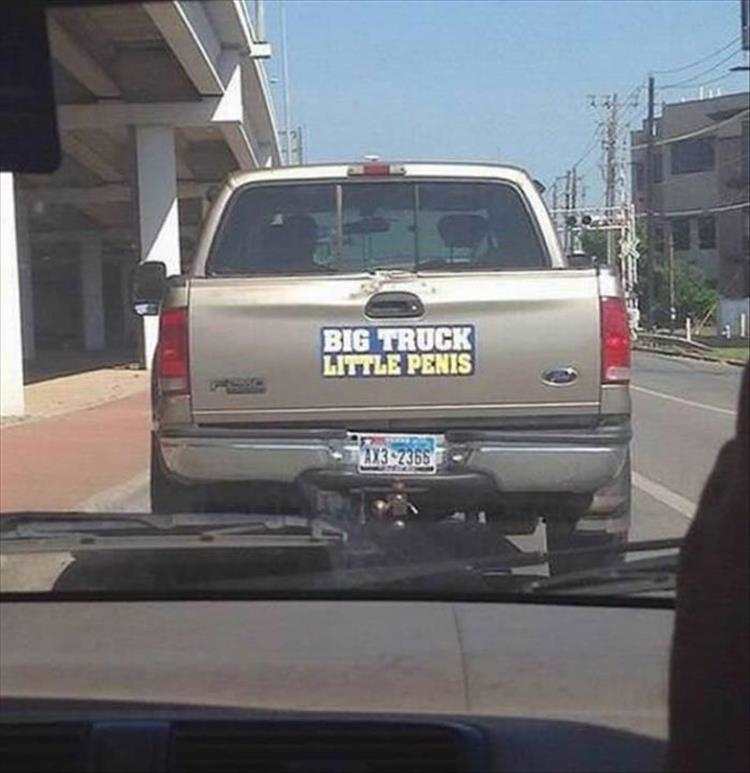
Find the location of a particular element. The width and height of the screenshot is (750, 773). window is located at coordinates (408, 220).